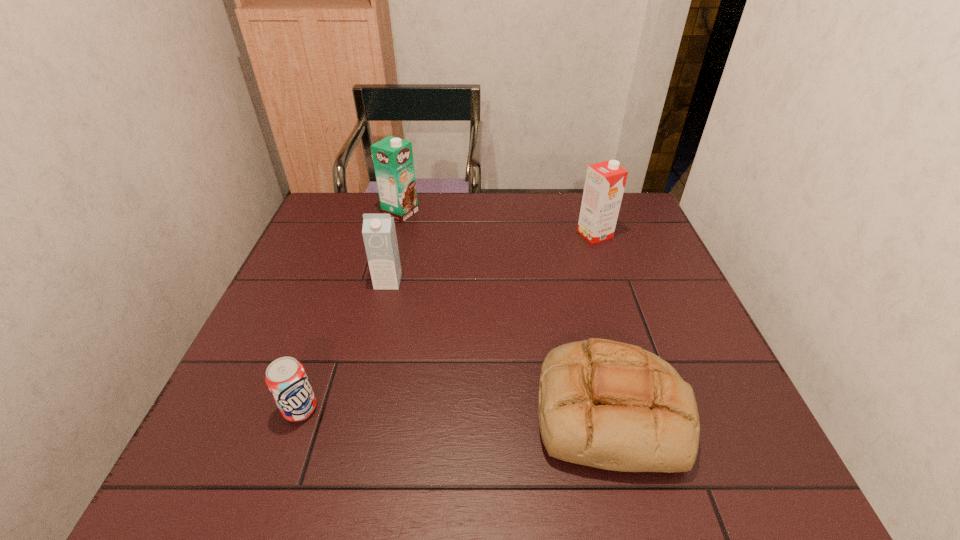
In order to click on the farthest carton in this screenshot , I will do `click(393, 161)`.

Where is `the rightmost carton`? This screenshot has height=540, width=960. the rightmost carton is located at coordinates (604, 186).

Identify the location of the fourth nearest object. This screenshot has width=960, height=540. click(604, 186).

Where is `the nearest carton`? The width and height of the screenshot is (960, 540). the nearest carton is located at coordinates (379, 234).

This screenshot has height=540, width=960. In order to click on bread in this screenshot , I will do coord(610,405).

Where is `soda can`? This screenshot has width=960, height=540. soda can is located at coordinates (286, 378).

Locate an element on the screen. The width and height of the screenshot is (960, 540). free space located on the right of the farthest carton is located at coordinates (537, 213).

Where is `free space located 0.150m on the left of the fourth nearest object`? This screenshot has width=960, height=540. free space located 0.150m on the left of the fourth nearest object is located at coordinates (528, 234).

This screenshot has width=960, height=540. Identify the location of free space located on the front label of the third nearest object. (382, 306).

This screenshot has width=960, height=540. I want to click on vacant space located on the back of the bread, so 592,340.